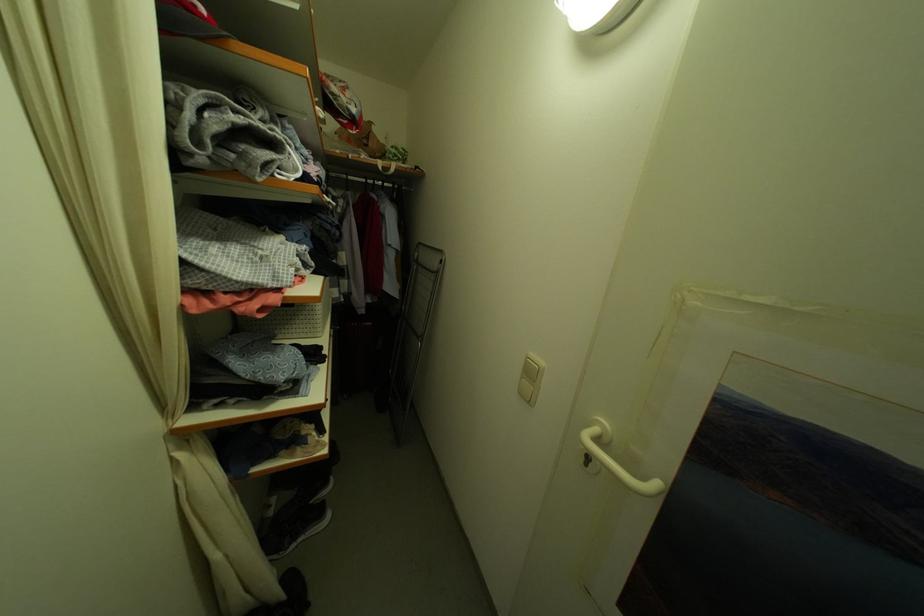
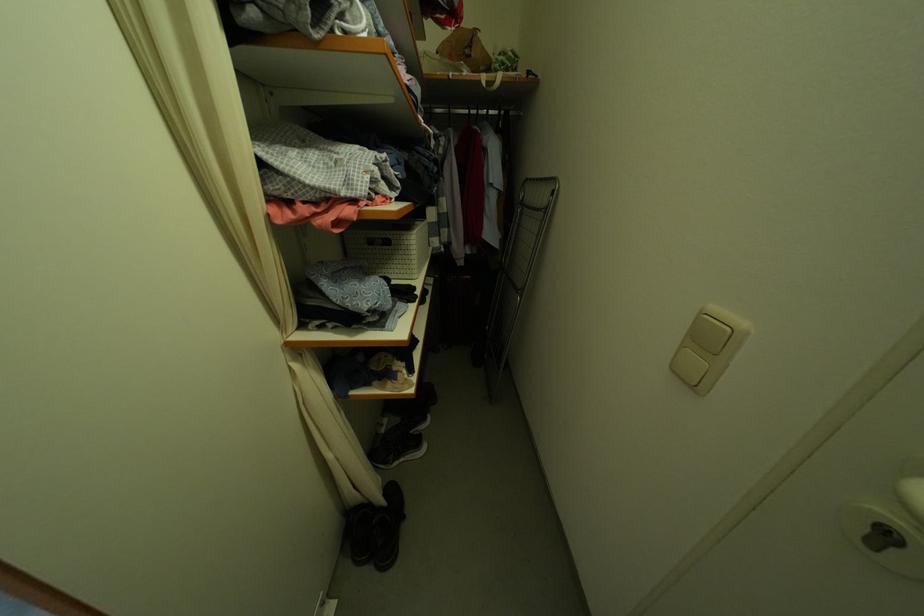
In the second image, find the point that corresponds to point (527, 379) in the first image.

(688, 349)